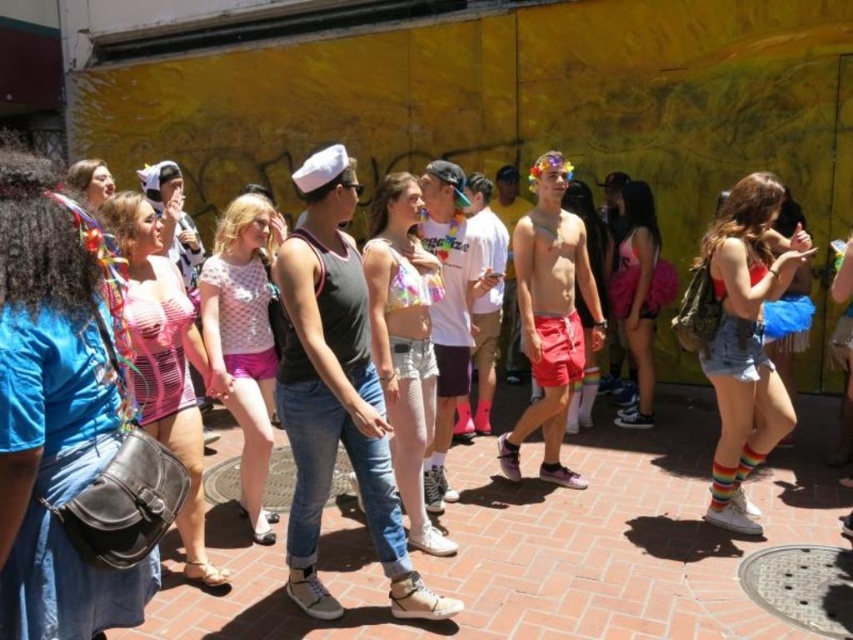
Is blue denim shirt at left above pink satin top at center?

Yes, blue denim shirt at left is above pink satin top at center.

How much distance is there between blue denim shirt at left and pink satin top at center?

37.95 inches

You are a GUI agent. You are given a task and a screenshot of the screen. Output one action in this format:
    pyautogui.click(x=<x>, y=<y>)
    Task: Click on the blue denim shirt at left
    This screenshot has width=853, height=640.
    Given the screenshot: What is the action you would take?
    pyautogui.click(x=54, y=416)

In order to click on blue denim shirt at left in this screenshot , I will do `click(54, 416)`.

Does blue denim shirt at left have a greater height compared to denim shorts at center?

Incorrect, blue denim shirt at left's height is not larger of denim shorts at center's.

Is blue denim shirt at left to the right of denim shorts at center from the viewer's perspective?

No, blue denim shirt at left is not to the right of denim shorts at center.

Between point (33, 550) and point (724, 289), which one is positioned behind?

Positioned behind is point (724, 289).

Find the location of a particular element. The width and height of the screenshot is (853, 640). blue denim shirt at left is located at coordinates (54, 416).

Is point (256, 408) farther from viewer compared to point (468, 243)?

No, it is not.

Can you confirm if pink satin shorts at center is positioned above rainbow striped socks at center?

Incorrect, pink satin shorts at center is not positioned above rainbow striped socks at center.

You are a GUI agent. You are given a task and a screenshot of the screen. Output one action in this format:
    pyautogui.click(x=<x>, y=<y>)
    Task: Click on the pink satin shorts at center
    Image resolution: width=853 pixels, height=640 pixels.
    Given the screenshot: What is the action you would take?
    pyautogui.click(x=242, y=340)